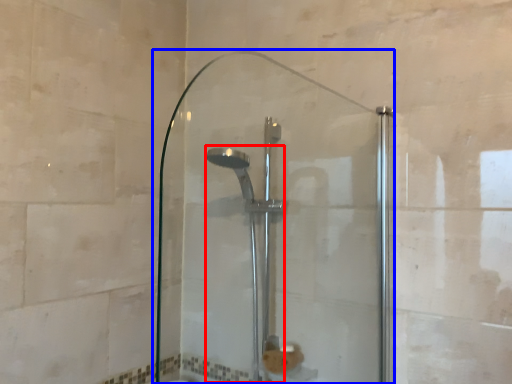
Question: Which object appears farthest to the camera in this image, shower (highlighted by a red box) or screen door (highlighted by a blue box)?

Choices:
 (A) shower
 (B) screen door

Answer: (A)